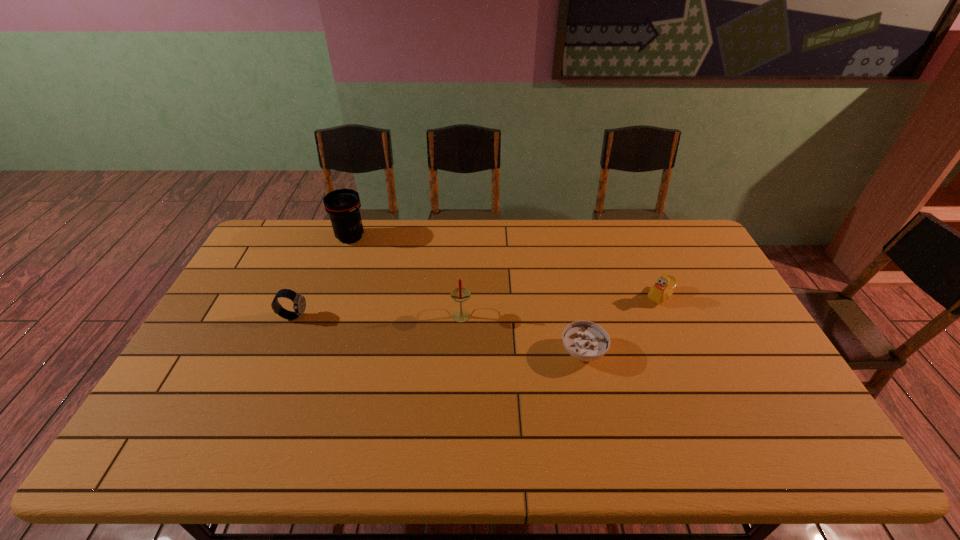
Where is `free spot between the watch and the rightmost object`? free spot between the watch and the rightmost object is located at coordinates (477, 306).

I want to click on unoccupied area between the rightmost object and the farthest object, so click(505, 267).

Where is `empty location between the third object from left to right and the soup bowl`? empty location between the third object from left to right and the soup bowl is located at coordinates (522, 333).

You are a GUI agent. You are given a task and a screenshot of the screen. Output one action in this format:
    pyautogui.click(x=<x>, y=<y>)
    Task: Click on the vacant region between the third object from right to left and the rightmost object
    The height and width of the screenshot is (540, 960).
    Given the screenshot: What is the action you would take?
    pyautogui.click(x=561, y=305)

At what (x,y) coordinates should I click in order to perform the action: click on vacant space in between the watch and the duck. Please return your answer as a coordinate pair (x, y). The image size is (960, 540). Looking at the image, I should click on (477, 306).

Identify the location of vacant space that's between the candle and the duck. This screenshot has height=540, width=960. (561, 305).

Find the location of a particular element. This screenshot has width=960, height=540. free space between the third object from left to right and the duck is located at coordinates (561, 305).

Point out which object is positioned as the nearest to the candle. Please provide its 2D coordinates. Your answer should be formatted as a tuple, i.e. [(x, y)], where the tuple contains the x and y coordinates of a point satisfying the conditions above.

[(586, 341)]

At what (x,y) coordinates should I click in order to perform the action: click on object that is the fourth closest to the watch. Please return your answer as a coordinate pair (x, y). The height and width of the screenshot is (540, 960). Looking at the image, I should click on (665, 285).

Locate an element on the screen. free space in the image that satisfies the following two spatial constraints: 1. on the face of the watch; 2. on the left side of the soup bowl is located at coordinates (278, 352).